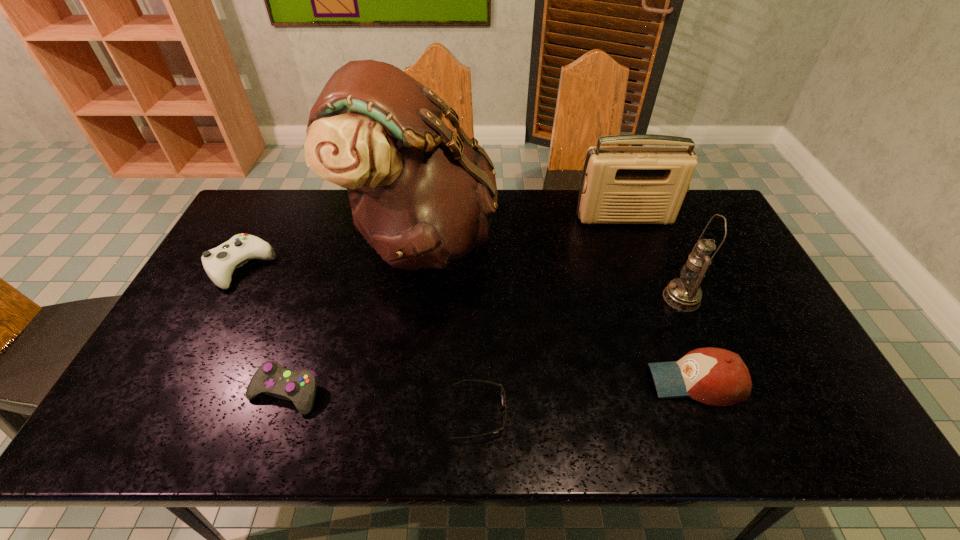
Identify the location of blank space located on the front-facing side of the radio receiver. (636, 247).

The image size is (960, 540). Find the location of `free region located 0.160m on the left of the oil lamp`. free region located 0.160m on the left of the oil lamp is located at coordinates (609, 298).

Locate an element on the screen. vacant region located 0.220m on the front-facing side of the baseball cap is located at coordinates (561, 382).

Locate an element on the screen. The width and height of the screenshot is (960, 540). vacant space located on the front-facing side of the baseball cap is located at coordinates (487, 382).

Where is `free space located 0.050m on the front-facing side of the baseball cap`? This screenshot has width=960, height=540. free space located 0.050m on the front-facing side of the baseball cap is located at coordinates (630, 382).

What are the coordinates of `free space located 0.070m on the right of the left control` in the screenshot? It's located at (297, 267).

I want to click on vacant space located on the back of the nearer control, so click(x=324, y=276).

This screenshot has width=960, height=540. Identify the location of free point located on the front-facing side of the sunglasses. (605, 413).

At what (x,y) coordinates should I click in order to perform the action: click on satchel present at the far edge. Please return your answer as a coordinate pair (x, y). Looking at the image, I should click on (422, 196).

Find the location of a particular element. This screenshot has height=540, width=960. radio receiver at the far edge is located at coordinates (620, 184).